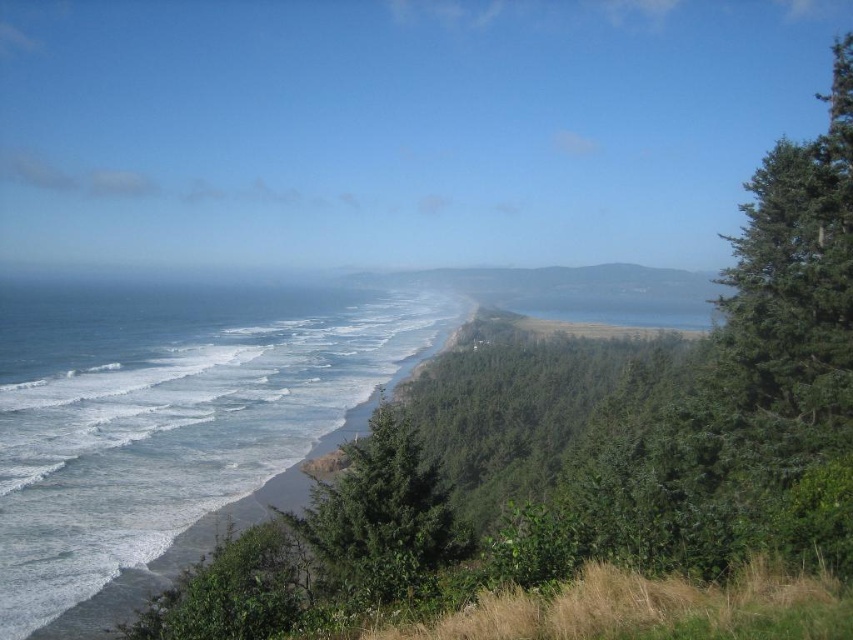
Question: Which object appears farthest from the camera in this image?

Choices:
 (A) blue water at lower left
 (B) green leafy tree at center

Answer: (A)

Question: Does blue water at lower left have a smaller size compared to green leafy tree at center?

Choices:
 (A) yes
 (B) no

Answer: (B)

Question: Does blue water at lower left have a smaller size compared to green leafy tree at center?

Choices:
 (A) no
 (B) yes

Answer: (A)

Question: Can you confirm if blue water at lower left is bigger than green leafy tree at center?

Choices:
 (A) yes
 (B) no

Answer: (A)